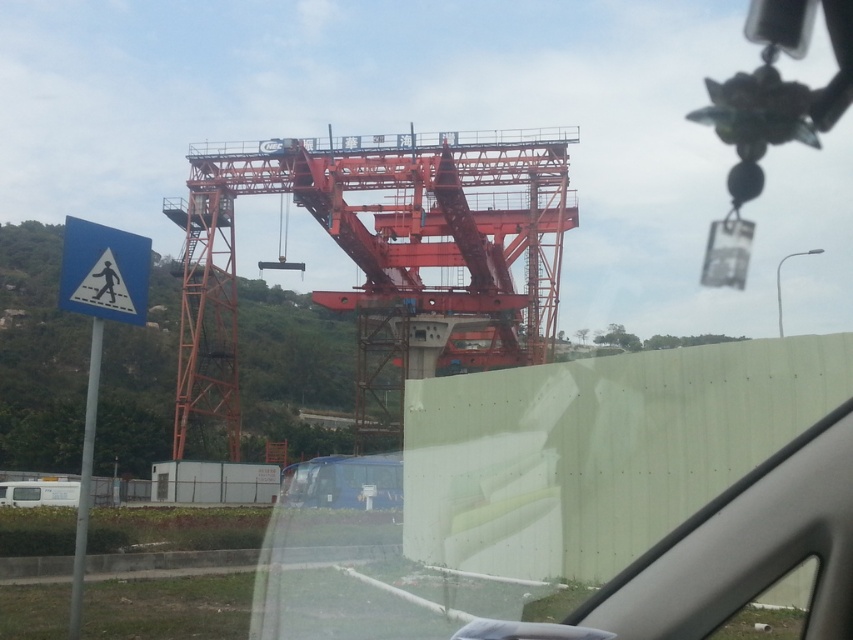
Question: Which object is positioned closest to the orange metallic crane at center?

Choices:
 (A) transparent glass windshield at upper center
 (B) blue plastic pedestrian crossing sign at left

Answer: (A)

Question: Which of the following is the closest to the observer?

Choices:
 (A) orange metallic crane at center
 (B) transparent glass windshield at upper center
 (C) blue plastic pedestrian crossing sign at left

Answer: (B)

Question: Considering the relative positions of transparent glass windshield at upper center and blue plastic pedestrian crossing sign at left in the image provided, where is transparent glass windshield at upper center located with respect to blue plastic pedestrian crossing sign at left?

Choices:
 (A) below
 (B) above

Answer: (B)

Question: Estimate the real-world distances between objects in this image. Which object is farther from the blue matte truck at center?

Choices:
 (A) transparent glass windshield at upper center
 (B) blue plastic pedestrian crossing sign at left
 (C) orange metallic crane at center

Answer: (B)

Question: Can you confirm if transparent glass windshield at upper center is thinner than orange metallic crane at center?

Choices:
 (A) no
 (B) yes

Answer: (A)

Question: Can you confirm if transparent glass windshield at upper center is positioned to the left of blue matte truck at center?

Choices:
 (A) yes
 (B) no

Answer: (B)